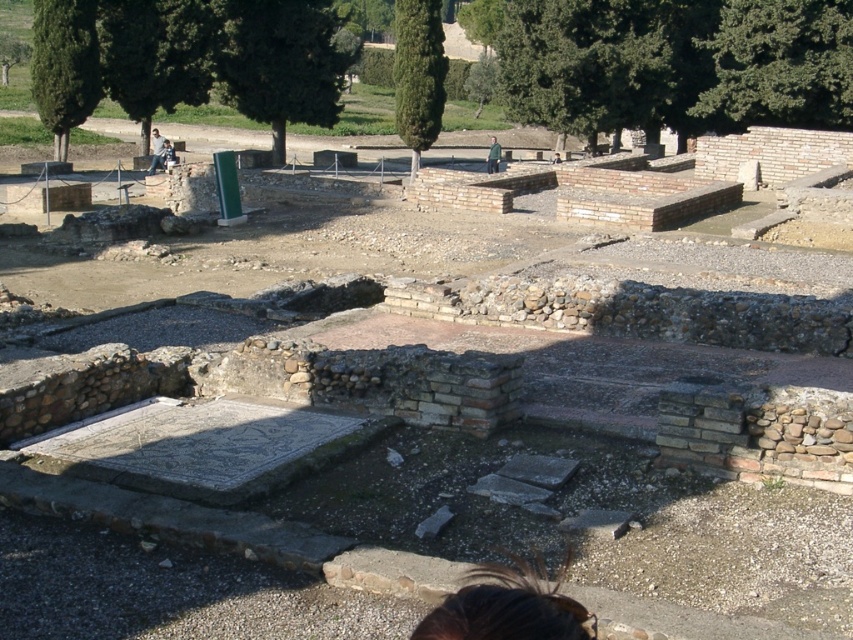
Question: Is brown hair at lower center above green fabric jacket at center?

Choices:
 (A) no
 (B) yes

Answer: (A)

Question: Which object is farther from the camera taking this photo?

Choices:
 (A) green fabric jacket at center
 (B) denim jacket at center

Answer: (A)

Question: Considering the real-world distances, which object is closest to the light brown leather jacket at center?

Choices:
 (A) green fabric jacket at center
 (B) brown hair at lower center
 (C) denim jacket at center

Answer: (C)

Question: Which object is farther from the camera taking this photo?

Choices:
 (A) green fabric jacket at center
 (B) denim jacket at center
 (C) light brown leather jacket at center

Answer: (A)

Question: Does denim jacket at center have a greater width compared to light brown leather jacket at center?

Choices:
 (A) yes
 (B) no

Answer: (B)

Question: Can you confirm if green fabric jacket at center is smaller than light brown leather jacket at center?

Choices:
 (A) yes
 (B) no

Answer: (B)